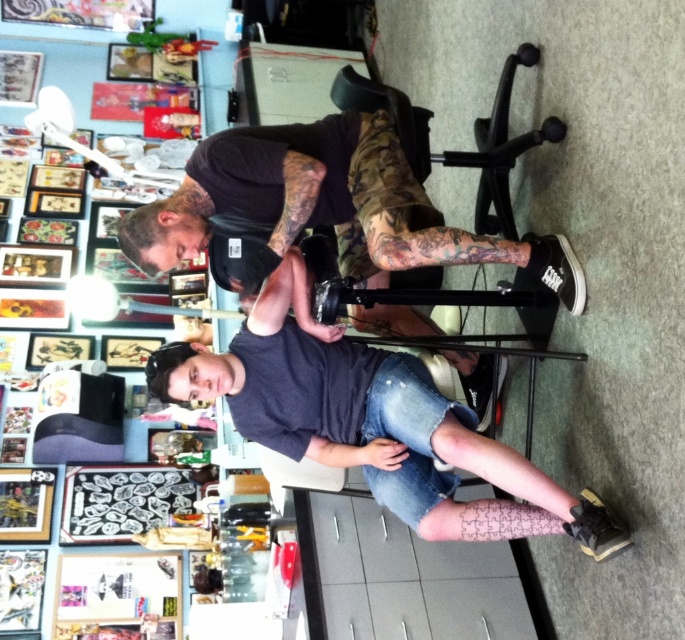
Question: Does matte black tattoo artist at center appear on the left side of black matte/black t-shirt at upper center?

Choices:
 (A) yes
 (B) no

Answer: (B)

Question: Does matte black tattoo artist at center have a greater width compared to black matte/black t-shirt at upper center?

Choices:
 (A) no
 (B) yes

Answer: (A)

Question: Which object appears closest to the camera in this image?

Choices:
 (A) black matte/black t-shirt at upper center
 (B) matte black tattoo artist at center

Answer: (B)

Question: Does matte black tattoo artist at center have a larger size compared to black matte/black t-shirt at upper center?

Choices:
 (A) no
 (B) yes

Answer: (B)

Question: Which object appears farthest from the camera in this image?

Choices:
 (A) matte black tattoo artist at center
 (B) black matte/black t-shirt at upper center

Answer: (B)